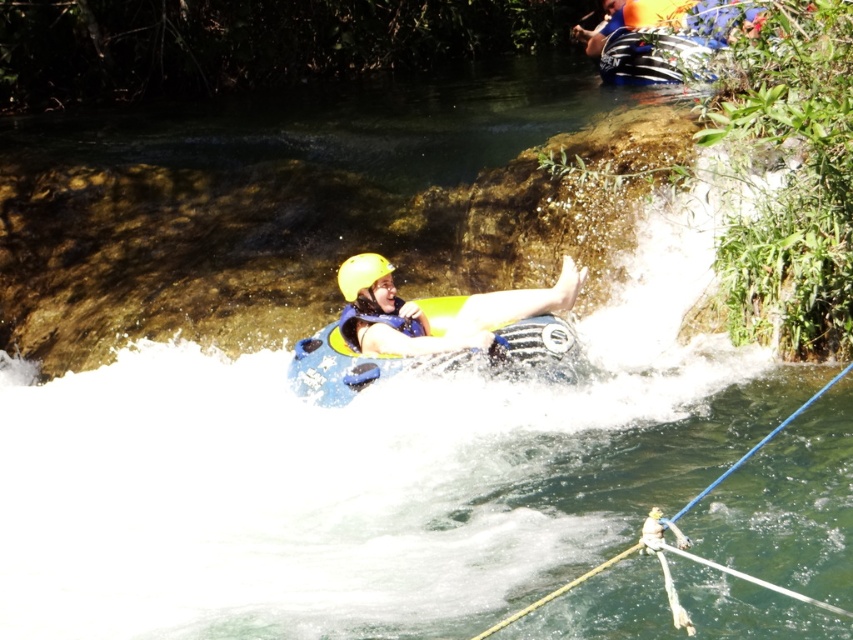
Question: Which of these objects is positioned farthest from the yellow matte helmet at center?

Choices:
 (A) blue rubber paddle at lower center
 (B) blue rubber boat at center
 (C) yellow matte life vest at center

Answer: (A)

Question: Which object is the closest to the yellow matte helmet at center?

Choices:
 (A) blue rubber paddle at lower center
 (B) yellow matte life vest at center
 (C) blue rubber boat at center

Answer: (B)

Question: Which point appears closest to the camera in this image?

Choices:
 (A) (358, 284)
 (B) (456, 304)
 (C) (419, 348)
 (D) (564, 589)

Answer: (D)

Question: Can you confirm if yellow matte life vest at center is positioned to the left of blue rubber paddle at lower center?

Choices:
 (A) no
 (B) yes

Answer: (B)

Question: Can you confirm if yellow matte life vest at center is positioned to the right of blue rubber boat at center?

Choices:
 (A) no
 (B) yes

Answer: (B)

Question: Does yellow matte life vest at center appear on the left side of blue rubber boat at center?

Choices:
 (A) no
 (B) yes

Answer: (A)